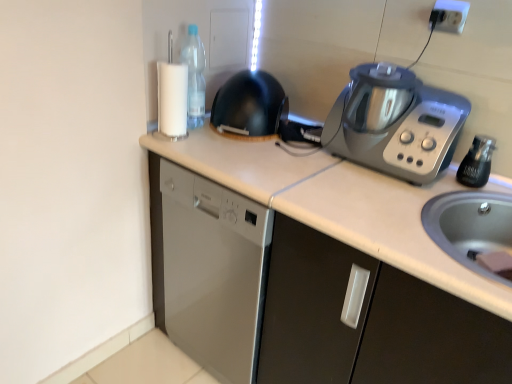
Question: Is white plastic electric outlet at upper right looking in the opposite direction of transparent plastic bottle at upper left, which appears as the 1th bottle when viewed from the left?

Choices:
 (A) no
 (B) yes

Answer: (A)

Question: From a real-world perspective, is white plastic electric outlet at upper right beneath transparent plastic bottle at upper left, arranged as the second bottle when viewed from the front?

Choices:
 (A) no
 (B) yes

Answer: (A)

Question: Can you confirm if white plastic electric outlet at upper right is shorter than transparent plastic bottle at upper left, the 1th bottle from the back?

Choices:
 (A) no
 (B) yes

Answer: (B)

Question: From the image's perspective, is white plastic electric outlet at upper right located beneath transparent plastic bottle at upper left, the 1th bottle from the back?

Choices:
 (A) no
 (B) yes

Answer: (A)

Question: Could you tell me if white plastic electric outlet at upper right is facing transparent plastic bottle at upper left, the 1th bottle from the back?

Choices:
 (A) no
 (B) yes

Answer: (A)

Question: From the image's perspective, is transparent plastic bottle at upper left, the 1th bottle from the back, located above or below silver metallic kitchen appliance at upper right?

Choices:
 (A) above
 (B) below

Answer: (A)

Question: In the image, is transparent plastic bottle at upper left, placed as the second bottle when sorted from right to left, positioned in front of or behind silver metallic kitchen appliance at upper right?

Choices:
 (A) front
 (B) behind

Answer: (B)

Question: In terms of size, does transparent plastic bottle at upper left, placed as the second bottle when sorted from right to left, appear bigger or smaller than silver metallic kitchen appliance at upper right?

Choices:
 (A) small
 (B) big

Answer: (A)

Question: In terms of height, does transparent plastic bottle at upper left, arranged as the second bottle when viewed from the front, look taller or shorter compared to silver metallic kitchen appliance at upper right?

Choices:
 (A) short
 (B) tall

Answer: (B)

Question: Is point (209, 117) positioned closer to the camera than point (188, 74)?

Choices:
 (A) farther
 (B) closer

Answer: (A)

Question: In terms of width, does black matte wok at center look wider or thinner when compared to transparent plastic bottle at upper left, the 1th bottle from the back?

Choices:
 (A) thin
 (B) wide

Answer: (B)

Question: Is black matte wok at center inside the boundaries of transparent plastic bottle at upper left, arranged as the second bottle when viewed from the front, or outside?

Choices:
 (A) outside
 (B) inside

Answer: (A)

Question: From their relative heights in the image, would you say black matte wok at center is taller or shorter than transparent plastic bottle at upper left, positioned as the 2th bottle in bottom-to-top order?

Choices:
 (A) tall
 (B) short

Answer: (B)

Question: Is point (250, 102) positioned closer to the camera than point (388, 147)?

Choices:
 (A) farther
 (B) closer

Answer: (A)

Question: From a real-world perspective, is black matte wok at center physically located above or below silver metallic kitchen appliance at upper right?

Choices:
 (A) below
 (B) above

Answer: (A)